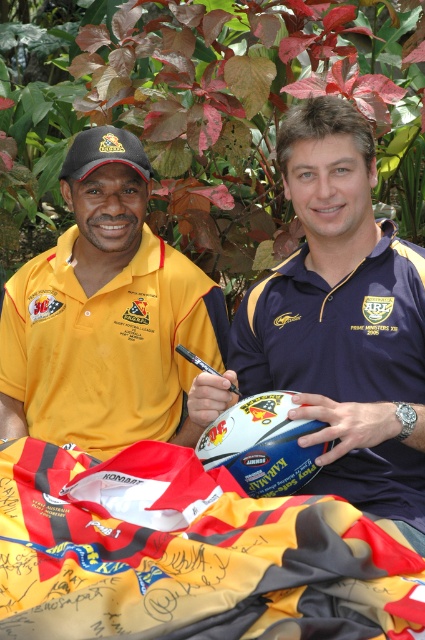
Can you confirm if yellow and red jersey at lower center is positioned to the right of yellow matte polo shirt at left?

Indeed, yellow and red jersey at lower center is positioned on the right side of yellow matte polo shirt at left.

Between yellow and red jersey at lower center and yellow matte polo shirt at left, which one appears on the left side from the viewer's perspective?

From the viewer's perspective, yellow matte polo shirt at left appears more on the left side.

Where is `yellow and red jersey at lower center`? The height and width of the screenshot is (640, 425). yellow and red jersey at lower center is located at coordinates (189, 554).

Does point (274, 532) come in front of point (340, 461)?

Yes, it is.

Does yellow and red jersey at lower center appear on the left side of blue fabric polo shirt at center?

Correct, you'll find yellow and red jersey at lower center to the left of blue fabric polo shirt at center.

This screenshot has width=425, height=640. Identify the location of yellow and red jersey at lower center. (189, 554).

Is blue fabric polo shirt at center to the left of yellow matte polo shirt at left from the viewer's perspective?

Incorrect, blue fabric polo shirt at center is not on the left side of yellow matte polo shirt at left.

Between point (317, 294) and point (88, 268), which one is positioned in front?

Point (317, 294) is more forward.

Identify the location of blue fabric polo shirt at center. (342, 317).